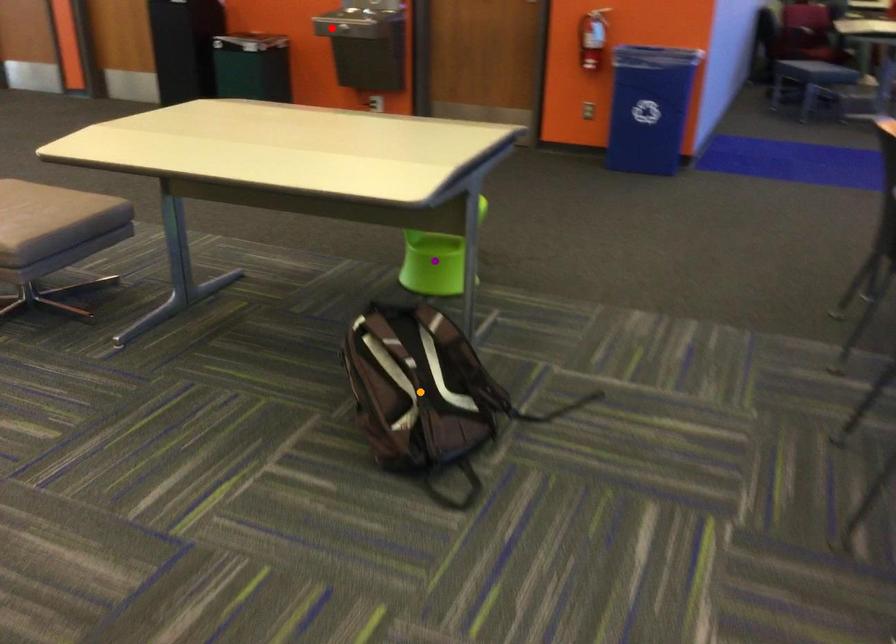
Order these from nearest to farthest:
purple point, orange point, red point

red point, purple point, orange point